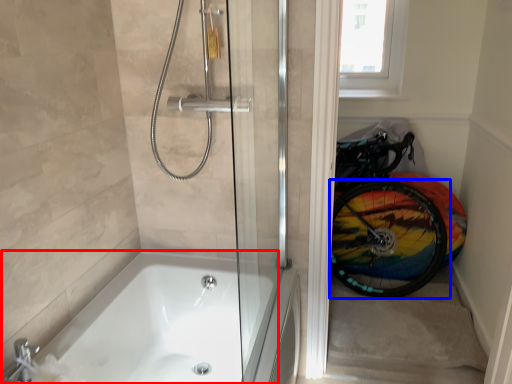
Question: Which object is further to the camera taking this photo, bathtub (highlighted by a red box) or bicycle wheel (highlighted by a blue box)?

Choices:
 (A) bathtub
 (B) bicycle wheel

Answer: (B)